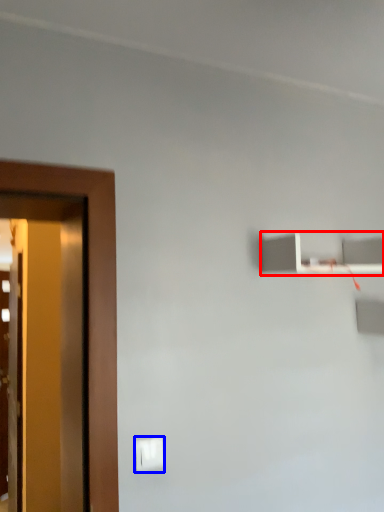
Question: Which of the following is the closest to the observer, shelf (highlighted by a red box) or light switch (highlighted by a blue box)?

Choices:
 (A) shelf
 (B) light switch

Answer: (B)